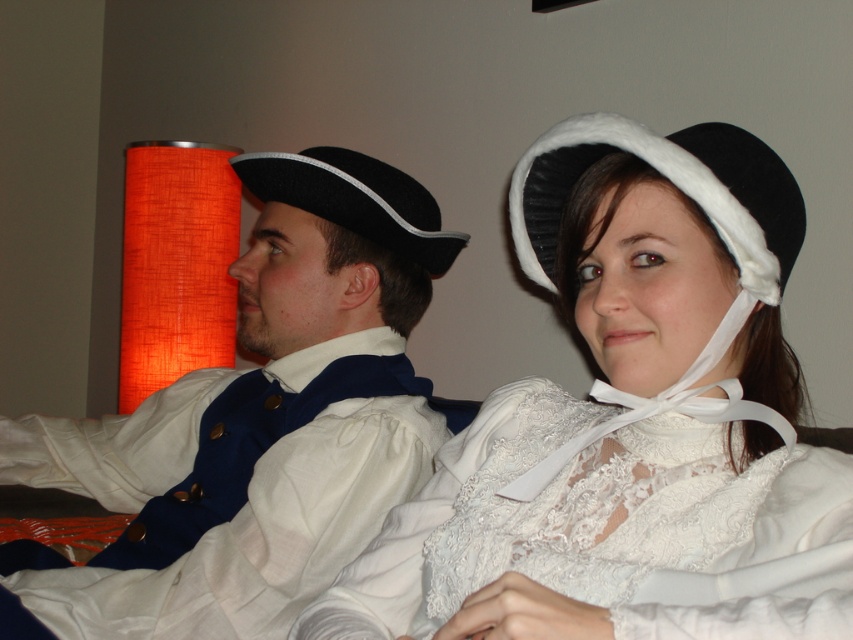
This screenshot has height=640, width=853. I want to click on black velvet bonnet at upper right, so click(672, 182).

I want to click on black velvet bonnet at upper right, so click(672, 182).

Where is `black velvet bonnet at upper right`? black velvet bonnet at upper right is located at coordinates (672, 182).

Between matte black hat at upper left and black felt tricorn hat at left, which one has more height?

matte black hat at upper left

Can you confirm if matte black hat at upper left is positioned below black felt tricorn hat at left?

Indeed, matte black hat at upper left is positioned under black felt tricorn hat at left.

Which is in front, point (351, 403) or point (405, 177)?

Point (351, 403) is more forward.

Locate an element on the screen. matte black hat at upper left is located at coordinates (256, 424).

Does point (479, 547) come closer to viewer compared to point (364, 157)?

Yes, point (479, 547) is closer to viewer.

Is point (497, 536) farther from camera compared to point (457, 252)?

No.

This screenshot has width=853, height=640. What are the coordinates of `white lace blouse at center` in the screenshot? It's located at (610, 529).